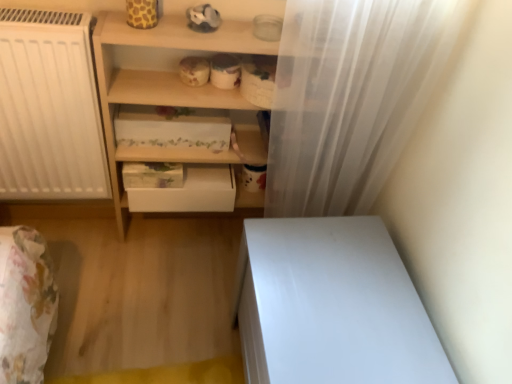
Measure the distance between point (255,151) and camera.

They are 4.84 feet apart.

Image resolution: width=512 pixels, height=384 pixels. What do you see at coordinates (350, 98) in the screenshot?
I see `white sheer curtain at right` at bounding box center [350, 98].

What is the approximate height of white glossy vanity at lower right?

It is 18.11 inches.

Image resolution: width=512 pixels, height=384 pixels. What do you see at coordinates (169, 87) in the screenshot?
I see `wooden shelf at center, positioned as the 1th shelf in bottom-to-top order` at bounding box center [169, 87].

In order to click on white matte drawer at center in this screenshot , I will do `click(189, 192)`.

Between point (123, 152) and point (400, 137), which one is positioned behind?

The point (123, 152) is more distant.

Considering the positions of objects wooden shelf at center, the 2th shelf viewed from the top, and white sheer curtain at right in the image provided, who is more to the right, wooden shelf at center, the 2th shelf viewed from the top, or white sheer curtain at right?

white sheer curtain at right.

Does wooden shelf at center, positioned as the 1th shelf in bottom-to-top order, lie in front of white sheer curtain at right?

No, it is not.

Consider the image. Is white sheer curtain at right inside wooden shelf at center, the 2th shelf viewed from the top?

No, white sheer curtain at right is not inside wooden shelf at center, the 2th shelf viewed from the top.

Based on the photo, is white glossy vanity at lower right directly adjacent to white sheer curtain at right?

There is a gap between white glossy vanity at lower right and white sheer curtain at right.

Is white glossy vanity at lower right smaller than white sheer curtain at right?

Actually, white glossy vanity at lower right might be larger than white sheer curtain at right.

Looking at this image, does white glossy vanity at lower right contain white sheer curtain at right?

Definitely not — white sheer curtain at right is not inside white glossy vanity at lower right.

Which of these two, white floral-patterned drawer at center, the second shelf from the bottom, or white sheer curtain at right, is thinner?

white sheer curtain at right is thinner.

Considering the positions of points (155, 120) and (306, 211), is point (155, 120) closer to camera compared to point (306, 211)?

No.

Is white floral-patterned drawer at center, the second shelf from the bottom, looking in the opposite direction of white sheer curtain at right?

No, white floral-patterned drawer at center, the second shelf from the bottom,'s orientation is not away from white sheer curtain at right.

Between white floral-patterned drawer at center, positioned as the first shelf in top-to-bottom order, and white sheer curtain at right, which one has less height?

With less height is white floral-patterned drawer at center, positioned as the first shelf in top-to-bottom order.

From a real-world perspective, is wooden shelf at center, the 2th shelf viewed from the top, physically below white glossy vanity at lower right?

No, from a real-world perspective, wooden shelf at center, the 2th shelf viewed from the top, is not beneath white glossy vanity at lower right.

Is wooden shelf at center, the 2th shelf viewed from the top, bigger than white glossy vanity at lower right?

Incorrect, wooden shelf at center, the 2th shelf viewed from the top, is not larger than white glossy vanity at lower right.

Which is correct: wooden shelf at center, positioned as the 1th shelf in bottom-to-top order, is inside white glossy vanity at lower right, or outside of it?

wooden shelf at center, positioned as the 1th shelf in bottom-to-top order, is outside white glossy vanity at lower right.

Can you confirm if wooden shelf at center, positioned as the 1th shelf in bottom-to-top order, is positioned to the right of white glossy vanity at lower right?

Incorrect, wooden shelf at center, positioned as the 1th shelf in bottom-to-top order, is not on the right side of white glossy vanity at lower right.

This screenshot has height=384, width=512. In order to click on shelf above the wooden shelf at center, the 2th shelf viewed from the top (from a real-world perspective) in this screenshot , I will do `click(202, 149)`.

From the image's perspective, between white floral-patterned drawer at center, the second shelf from the bottom, and wooden shelf at center, the 2th shelf viewed from the top, who is located below?

wooden shelf at center, the 2th shelf viewed from the top, appears lower in the image.

Is white floral-patterned drawer at center, positioned as the first shelf in top-to-bottom order, facing away from wooden shelf at center, the 2th shelf viewed from the top?

Absolutely, white floral-patterned drawer at center, positioned as the first shelf in top-to-bottom order, is directed away from wooden shelf at center, the 2th shelf viewed from the top.

Can you tell me how much white sheer curtain at right and white glossy vanity at lower right differ in facing direction?

89.6 degrees separate the facing orientations of white sheer curtain at right and white glossy vanity at lower right.

Would you say white sheer curtain at right is outside white glossy vanity at lower right?

white sheer curtain at right is positioned outside white glossy vanity at lower right.

Is white glossy vanity at lower right at the back of white sheer curtain at right?

No, white sheer curtain at right's orientation is not away from white glossy vanity at lower right.

From the image's perspective, is white glossy vanity at lower right over white floral-patterned drawer at center, the second shelf from the bottom?

Actually, white glossy vanity at lower right appears below white floral-patterned drawer at center, the second shelf from the bottom, in the image.

Who is smaller, white glossy vanity at lower right or white floral-patterned drawer at center, the second shelf from the bottom?

white floral-patterned drawer at center, the second shelf from the bottom.

Identify the location of vanity on the right of white floral-patterned drawer at center, positioned as the first shelf in top-to-bottom order. (331, 306).

Find the location of `the 2nd shelf located beneath the white sheer curtain at right (from a real-world perspective)`. the 2nd shelf located beneath the white sheer curtain at right (from a real-world perspective) is located at coordinates (169, 87).

At what (x,y) coordinates should I click in order to perform the action: click on shower curtain that appears behind the white glossy vanity at lower right. Please return your answer as a coordinate pair (x, y). Looking at the image, I should click on (350, 98).

From the image, which object appears to be nearer to white glossy vanity at lower right, white sheer curtain at right or wooden shelf at center, the 2th shelf viewed from the top?

Among the two, white sheer curtain at right is located nearer to white glossy vanity at lower right.

Which object lies further to the anchor point white matte drawer at center, white sheer curtain at right or white glossy vanity at lower right?

white glossy vanity at lower right is further to white matte drawer at center.

When comparing their distances from white matte drawer at center, does white floral-patterned drawer at center, positioned as the first shelf in top-to-bottom order, or wooden shelf at center, positioned as the 1th shelf in bottom-to-top order, seem further?

The object further to white matte drawer at center is wooden shelf at center, positioned as the 1th shelf in bottom-to-top order.

From the image, which object appears to be nearer to white matte drawer at center, white sheer curtain at right or wooden shelf at center, the 2th shelf viewed from the top?

Among the two, wooden shelf at center, the 2th shelf viewed from the top, is located nearer to white matte drawer at center.

Considering their positions, is white matte drawer at center positioned further to white sheer curtain at right than white glossy vanity at lower right?

white matte drawer at center.

Looking at the image, which one is located closer to white floral-patterned drawer at center, positioned as the first shelf in top-to-bottom order, wooden shelf at center, positioned as the 1th shelf in bottom-to-top order, or white matte drawer at center?

wooden shelf at center, positioned as the 1th shelf in bottom-to-top order, is positioned closer to the anchor white floral-patterned drawer at center, positioned as the first shelf in top-to-bottom order.

Which object lies nearer to the anchor point wooden shelf at center, the 2th shelf viewed from the top, white matte drawer at center or white sheer curtain at right?

white matte drawer at center.

Which object lies nearer to the anchor point white glossy vanity at lower right, wooden shelf at center, positioned as the 1th shelf in bottom-to-top order, or white matte drawer at center?

white matte drawer at center lies closer to white glossy vanity at lower right than the other object.

The width and height of the screenshot is (512, 384). What are the coordinates of `shelf between wooden shelf at center, the 2th shelf viewed from the top, and white matte drawer at center in the front-back direction` in the screenshot? It's located at (202, 149).

Locate an element on the screen. Image resolution: width=512 pixels, height=384 pixels. shower curtain between white floral-patterned drawer at center, the second shelf from the bottom, and white glossy vanity at lower right in the up-down direction is located at coordinates (350, 98).

Identify the location of shower curtain between white glossy vanity at lower right and white matte drawer at center from front to back. (350, 98).

Find the location of a particular element. This screenshot has height=384, width=512. shelf between white sheer curtain at right and white glossy vanity at lower right vertically is located at coordinates (169, 87).